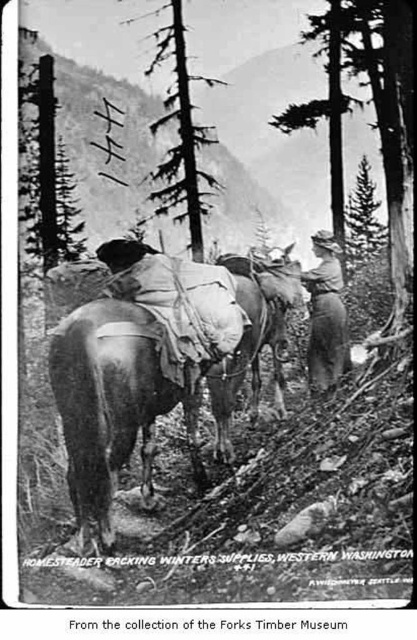
Is smooth bark tree at center taller than green leafy tree at upper center?

Incorrect, smooth bark tree at center's height is not larger of green leafy tree at upper center's.

Between point (178, 150) and point (358, 262), which one is positioned in front?

Point (178, 150)

The height and width of the screenshot is (640, 417). What do you see at coordinates (180, 134) in the screenshot?
I see `smooth bark tree at center` at bounding box center [180, 134].

The height and width of the screenshot is (640, 417). In order to click on smooth bark tree at center in this screenshot , I will do `click(180, 134)`.

Does smooth bark tree at center have a lesser height compared to brown leather hat at center?

Yes, smooth bark tree at center is shorter than brown leather hat at center.

Measure the distance between point (180, 88) and camera.

They are 17.30 meters apart.

Does point (215, 179) lie in front of point (331, 276)?

No, (215, 179) is behind (331, 276).

Locate an element on the screen. smooth bark tree at center is located at coordinates (180, 134).

Consider the image. Does brown leather saddle at center appear over green leafy tree at upper center?

Actually, brown leather saddle at center is below green leafy tree at upper center.

Based on the photo, which is more to the left, brown leather saddle at center or green leafy tree at upper center?

brown leather saddle at center is more to the left.

Does point (67, 413) come in front of point (367, 200)?

Yes, it is in front of point (367, 200).

What are the coordinates of `brown leather saddle at center` in the screenshot? It's located at (110, 404).